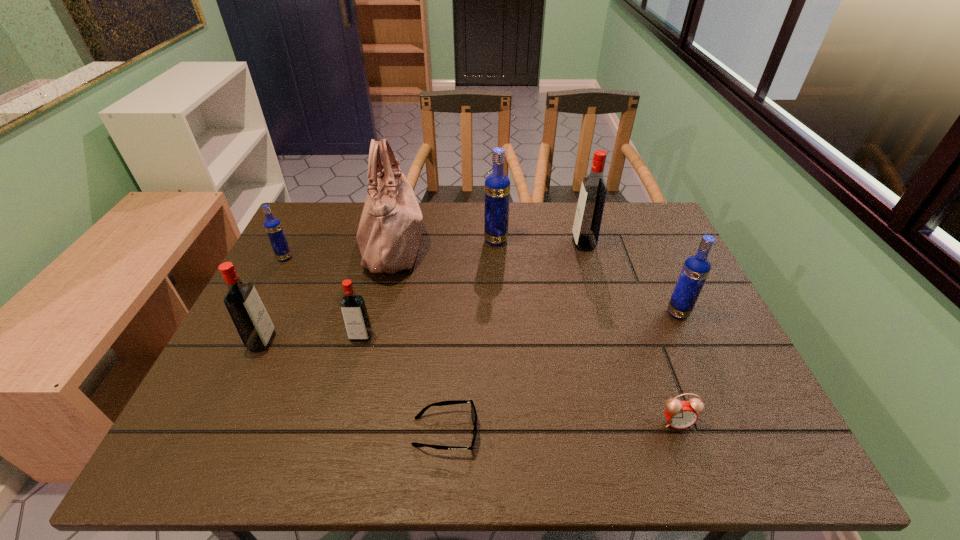
You are a GUI agent. You are given a task and a screenshot of the screen. Output one action in this format:
    pyautogui.click(x=<x>, y=<y>)
    Task: Click on the fourth nearest vodka
    
    Given the screenshot: What is the action you would take?
    pyautogui.click(x=273, y=227)

The width and height of the screenshot is (960, 540). In order to click on the smallest red vodka in this screenshot , I will do `click(353, 308)`.

You are a GUI agent. You are given a task and a screenshot of the screen. Output one action in this format:
    pyautogui.click(x=<x>, y=<y>)
    Task: Click on the third vodka from left to right
    Image resolution: width=960 pixels, height=540 pixels.
    Given the screenshot: What is the action you would take?
    pyautogui.click(x=353, y=308)

Identify the location of the eighth object from left to right. The image size is (960, 540). (680, 414).

Image resolution: width=960 pixels, height=540 pixels. In order to click on alarm clock in this screenshot , I will do (x=680, y=414).

At what (x,y) coordinates should I click in order to perform the action: click on black sunglasses. Please return your answer as a coordinate pair (x, y). Looking at the image, I should click on (473, 411).

Where is `sunglasses`? sunglasses is located at coordinates (473, 411).

I want to click on vacant area situated 0.230m at the front of the handbag with handles, so click(501, 245).

You are a GUI agent. You are given a task and a screenshot of the screen. Output one action in this format:
    pyautogui.click(x=<x>, y=<y>)
    Task: Click on the vacant space located 0.070m on the front and back of the biggest red vodka
    Image resolution: width=960 pixels, height=540 pixels.
    Given the screenshot: What is the action you would take?
    pyautogui.click(x=550, y=243)

This screenshot has height=540, width=960. What are the coordinates of `vacant area situated 0.330m on the front and back of the biggest red vodka` in the screenshot? It's located at (466, 243).